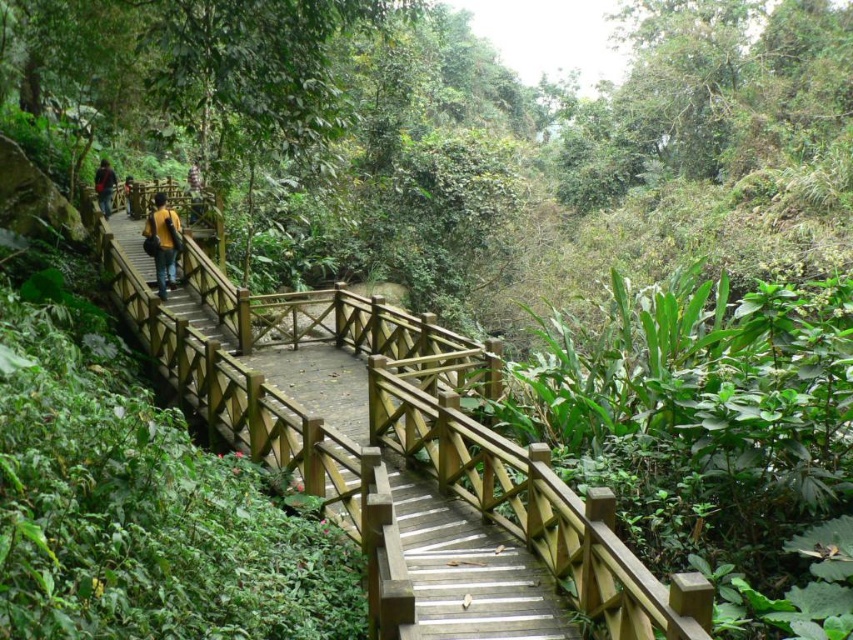
You are standing on the wooden walkway in the forest and see a point marked at coordinates (399, 442). What is located at that point?

The point at coordinates (399, 442) indicates a wooden bridge at center.

You are a hiker who has misplaced your jacket while walking on the wooden walkway in the forest. You remember seeing your yellow matte jacket at center and your dark blue jeans at center. Can you reach your jacket from your current position without leaving the walkway?

The distance between the yellow matte jacket at center and dark blue jeans at center is 4.69 meters. Since you are standing where your dark blue jeans are located, you can walk along the walkway to retrieve your jacket as the distance is manageable and the walkway provides a safe path.

From the picture: You are a hiker standing at the starting point of the wooden walkway. You see a point marked at coordinates (399, 442). Where is this point located in relation to the wooden walkway?

The point marked at coordinates (399, 442) is located on the wooden bridge at center, which is part of the wooden walkway.